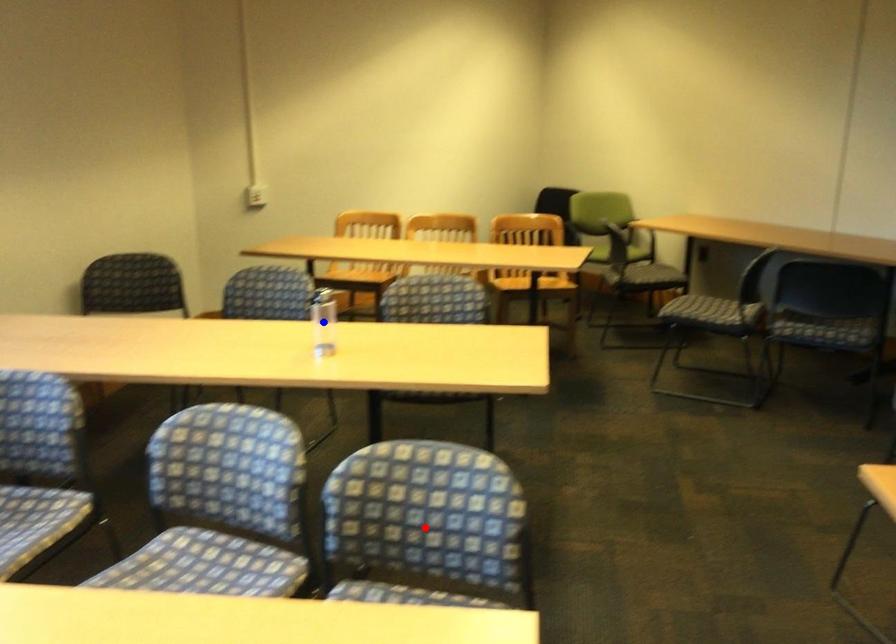
Question: In the image, two points are highlighted. Which point is nearer to the camera? Reply with the corresponding letter.

Choices:
 (A) blue point
 (B) red point

Answer: (B)